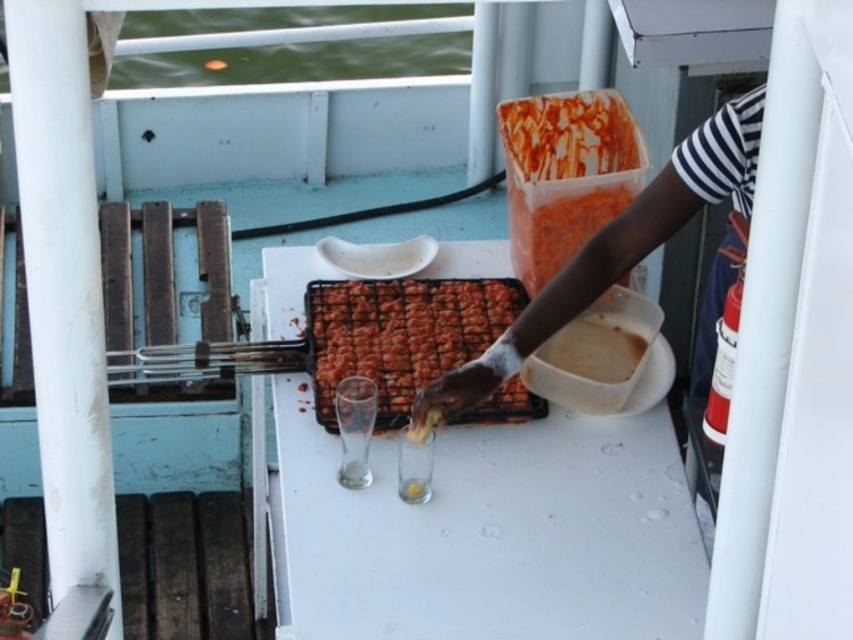
You are a guest at a barbecue party on the boat. You see a dark skin arm at center holding a skewer and a matte plastic container at upper center with marinade. Which object is closer to your right side?

The dark skin arm at center is positioned on the right side of the matte plastic container at upper center, so the dark skin arm at center is closer to your right side.